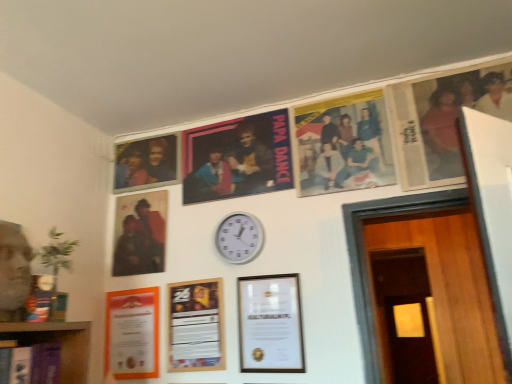
Locate an element on the screen. matte paper poster at upper center, marked as the 1th poster in a left-to-right arrangement is located at coordinates (237, 158).

Describe the element at coordinates (344, 144) in the screenshot. I see `printed paper poster at upper center, which ranks as the 2th poster in left-to-right order` at that location.

In order to click on matte orange certificate at lower left, which is the 2th picture frame from left to right in this screenshot , I will do `click(132, 334)`.

Describe the element at coordinates (442, 119) in the screenshot. I see `matte plastic photo frame at upper right, which is the first picture frame from right to left` at that location.

The width and height of the screenshot is (512, 384). I want to click on wooden door at lower right, so click(x=410, y=340).

The image size is (512, 384). I want to click on picture frame above the printed paper poster at upper center, marked as the 1th poster in a right-to-left arrangement (from a real-world perspective), so tap(146, 163).

Considering the positions of objects printed paper poster at upper center, which ranks as the 2th poster in left-to-right order, and matte plastic photo frame at upper left, which ranks as the third picture frame in left-to-right order, in the image provided, who is in front, printed paper poster at upper center, which ranks as the 2th poster in left-to-right order, or matte plastic photo frame at upper left, which ranks as the third picture frame in left-to-right order,?

printed paper poster at upper center, which ranks as the 2th poster in left-to-right order.

Which of these two, printed paper poster at upper center, marked as the 1th poster in a right-to-left arrangement, or matte plastic photo frame at upper left, the 4th picture frame positioned from the right, is thinner?

Thinner between the two is printed paper poster at upper center, marked as the 1th poster in a right-to-left arrangement.

Which is more to the left, printed paper poster at upper center, marked as the 1th poster in a right-to-left arrangement, or matte plastic photo frame at upper left, which ranks as the third picture frame in left-to-right order?

matte plastic photo frame at upper left, which ranks as the third picture frame in left-to-right order.

From a real-world perspective, is matte plastic photo frame at upper right, which is the first picture frame from right to left, positioned over wooden door at lower right based on gravity?

Yes, from a real-world perspective, matte plastic photo frame at upper right, which is the first picture frame from right to left, is on top of wooden door at lower right.

Which of these two, matte plastic photo frame at upper right, which is the first picture frame from right to left, or wooden door at lower right, is bigger?

With larger size is wooden door at lower right.

You are a GUI agent. You are given a task and a screenshot of the screen. Output one action in this format:
    pyautogui.click(x=<x>, y=<y>)
    Task: Click on the door on the right of matte plastic photo frame at upper right, arranged as the sixth picture frame when viewed from the left
    The image size is (512, 384).
    Given the screenshot: What is the action you would take?
    pyautogui.click(x=410, y=340)

Is matte plastic photo frame at upper right, which is the first picture frame from right to left, facing away from wooden door at lower right?

Yes, matte plastic photo frame at upper right, which is the first picture frame from right to left,'s orientation is away from wooden door at lower right.

Which object is further away from the camera, printed paper poster at upper center, which ranks as the 2th poster in left-to-right order, or wooden framed poster at center, which ranks as the third picture frame in right-to-left order?

wooden framed poster at center, which ranks as the third picture frame in right-to-left order.

Image resolution: width=512 pixels, height=384 pixels. Find the location of `the 2nd picture frame to the left when counting from the printed paper poster at upper center, marked as the 1th poster in a right-to-left arrangement`. the 2nd picture frame to the left when counting from the printed paper poster at upper center, marked as the 1th poster in a right-to-left arrangement is located at coordinates (196, 326).

Between point (319, 136) and point (190, 336), which one is positioned behind?

The point (319, 136) is more distant.

Based on the photo, is printed paper poster at upper center, marked as the 1th poster in a right-to-left arrangement, taller or shorter than wooden framed poster at center, marked as the 4th picture frame in a left-to-right arrangement?

In the image, printed paper poster at upper center, marked as the 1th poster in a right-to-left arrangement, appears to be taller than wooden framed poster at center, marked as the 4th picture frame in a left-to-right arrangement.

From the image's perspective, who appears lower, wooden framed poster at center, marked as the 4th picture frame in a left-to-right arrangement, or matte paper poster at upper center, arranged as the 2th poster when viewed from the right?

wooden framed poster at center, marked as the 4th picture frame in a left-to-right arrangement, appears lower in the image.

Which picture frame is the 2nd one when counting from the front of the matte paper poster at upper center, marked as the 1th poster in a left-to-right arrangement? Please provide its 2D coordinates.

[(196, 326)]

Considering the points (172, 359) and (203, 158), which point is behind, point (172, 359) or point (203, 158)?

The point (203, 158) is more distant.

Is matte paper poster at upper center, marked as the 1th poster in a left-to-right arrangement, located within wooden framed poster at center, which ranks as the third picture frame in right-to-left order?

No, matte paper poster at upper center, marked as the 1th poster in a left-to-right arrangement, is not inside wooden framed poster at center, which ranks as the third picture frame in right-to-left order.

In the scene shown: Can you confirm if white plastic wall clock at center is positioned to the right of printed paper poster at upper center, which ranks as the 2th poster in left-to-right order?

No, white plastic wall clock at center is not to the right of printed paper poster at upper center, which ranks as the 2th poster in left-to-right order.

How far apart are white plastic wall clock at center and printed paper poster at upper center, which ranks as the 2th poster in left-to-right order?

A distance of 40.55 centimeters exists between white plastic wall clock at center and printed paper poster at upper center, which ranks as the 2th poster in left-to-right order.

Could you tell me if white plastic wall clock at center is facing printed paper poster at upper center, marked as the 1th poster in a right-to-left arrangement?

No, white plastic wall clock at center is not turned towards printed paper poster at upper center, marked as the 1th poster in a right-to-left arrangement.

From the image's perspective, which one is positioned lower, white plastic wall clock at center or printed paper poster at upper center, which ranks as the 2th poster in left-to-right order?

white plastic wall clock at center.

From a real-world perspective, does white plastic wall clock at center stand above matte paper poster at upper center, arranged as the 2th poster when viewed from the right?

No, from a real-world perspective, white plastic wall clock at center is not above matte paper poster at upper center, arranged as the 2th poster when viewed from the right.

From the image's perspective, which is above, white plastic wall clock at center or matte paper poster at upper center, arranged as the 2th poster when viewed from the right?

matte paper poster at upper center, arranged as the 2th poster when viewed from the right, is shown above in the image.

Considering the relative positions of white plastic wall clock at center and matte paper poster at upper center, arranged as the 2th poster when viewed from the right, in the image provided, is white plastic wall clock at center to the left or to the right of matte paper poster at upper center, arranged as the 2th poster when viewed from the right,?

Clearly, white plastic wall clock at center is on the right of matte paper poster at upper center, arranged as the 2th poster when viewed from the right, in the image.

From the picture: Would you say white plastic wall clock at center contains matte paper poster at upper center, arranged as the 2th poster when viewed from the right?

Actually, matte paper poster at upper center, arranged as the 2th poster when viewed from the right, is outside white plastic wall clock at center.

Between matte plastic photo frame at upper right, arranged as the sixth picture frame when viewed from the left, and wooden picture frame at center, marked as the 2th picture frame in a right-to-left arrangement, which one has larger size?

matte plastic photo frame at upper right, arranged as the sixth picture frame when viewed from the left, is bigger.

Is matte plastic photo frame at upper right, arranged as the sixth picture frame when viewed from the left, shorter than wooden picture frame at center, positioned as the 5th picture frame in left-to-right order?

Incorrect, the height of matte plastic photo frame at upper right, arranged as the sixth picture frame when viewed from the left, does not fall short of that of wooden picture frame at center, positioned as the 5th picture frame in left-to-right order.

Where is `the 1st picture frame to the left of the matte plastic photo frame at upper right, which is the first picture frame from right to left, counting from the anchor's position`? The image size is (512, 384). the 1st picture frame to the left of the matte plastic photo frame at upper right, which is the first picture frame from right to left, counting from the anchor's position is located at coordinates pyautogui.click(x=270, y=324).

Are matte plastic photo frame at upper right, arranged as the sixth picture frame when viewed from the left, and wooden picture frame at center, marked as the 2th picture frame in a right-to-left arrangement, located far from each other?

No, matte plastic photo frame at upper right, arranged as the sixth picture frame when viewed from the left, is not far away from wooden picture frame at center, marked as the 2th picture frame in a right-to-left arrangement.

Where is `the 4th picture frame behind the printed paper poster at upper center, marked as the 1th poster in a right-to-left arrangement`? The width and height of the screenshot is (512, 384). the 4th picture frame behind the printed paper poster at upper center, marked as the 1th poster in a right-to-left arrangement is located at coordinates (146, 163).

The height and width of the screenshot is (384, 512). Find the location of `picture frame that is the 5th one above the wooden door at lower right (from a real-world perspective)`. picture frame that is the 5th one above the wooden door at lower right (from a real-world perspective) is located at coordinates (442, 119).

Looking at the image, which one is located further to matte paper poster at upper center, marked as the 1th poster in a left-to-right arrangement, wooden door at lower right or matte plastic photo frame at upper right, which is the first picture frame from right to left?

wooden door at lower right is further to matte paper poster at upper center, marked as the 1th poster in a left-to-right arrangement.

Looking at this image, considering their positions, is wooden framed poster at center, which ranks as the third picture frame in right-to-left order, positioned further to matte plastic photo frame at upper right, arranged as the sixth picture frame when viewed from the left, than wooden door at lower right?

Among the two, wooden door at lower right is located further to matte plastic photo frame at upper right, arranged as the sixth picture frame when viewed from the left.

Which object lies further to the anchor point printed paper poster at upper center, which ranks as the 2th poster in left-to-right order, wooden door at lower right or matte black photo frame at center-left, which is the sixth picture frame in right-to-left order?

wooden door at lower right is positioned further to the anchor printed paper poster at upper center, which ranks as the 2th poster in left-to-right order.

When comparing their distances from wooden framed poster at center, which ranks as the third picture frame in right-to-left order, does wooden door at lower right or printed paper poster at upper center, which ranks as the 2th poster in left-to-right order, seem closer?

printed paper poster at upper center, which ranks as the 2th poster in left-to-right order, lies closer to wooden framed poster at center, which ranks as the third picture frame in right-to-left order, than the other object.

Based on their spatial positions, is matte plastic photo frame at upper left, the 4th picture frame positioned from the right, or matte paper poster at upper center, arranged as the 2th poster when viewed from the right, closer to wooden picture frame at center, marked as the 2th picture frame in a right-to-left arrangement?

Among the two, matte paper poster at upper center, arranged as the 2th poster when viewed from the right, is located nearer to wooden picture frame at center, marked as the 2th picture frame in a right-to-left arrangement.

Looking at the image, which one is located further to white plastic wall clock at center, matte plastic photo frame at upper right, arranged as the sixth picture frame when viewed from the left, or wooden door at lower right?

The object further to white plastic wall clock at center is wooden door at lower right.

Considering their positions, is wooden door at lower right positioned closer to printed paper poster at upper center, which ranks as the 2th poster in left-to-right order, than matte plastic photo frame at upper right, arranged as the sixth picture frame when viewed from the left?

Among the two, matte plastic photo frame at upper right, arranged as the sixth picture frame when viewed from the left, is located nearer to printed paper poster at upper center, which ranks as the 2th poster in left-to-right order.

When comparing their distances from printed paper poster at upper center, which ranks as the 2th poster in left-to-right order, does matte paper poster at upper center, marked as the 1th poster in a left-to-right arrangement, or matte plastic photo frame at upper right, arranged as the sixth picture frame when viewed from the left, seem closer?

matte plastic photo frame at upper right, arranged as the sixth picture frame when viewed from the left, is positioned closer to the anchor printed paper poster at upper center, which ranks as the 2th poster in left-to-right order.

The height and width of the screenshot is (384, 512). I want to click on wall clock situated between matte orange certificate at lower left, which is the 2th picture frame from left to right, and printed paper poster at upper center, which ranks as the 2th poster in left-to-right order, from left to right, so click(x=239, y=238).

Identify the location of picture frame between white plastic wall clock at center and wooden framed poster at center, which ranks as the third picture frame in right-to-left order, in the up-down direction. This screenshot has width=512, height=384. (270, 324).

Find the location of `poster positioned between printed paper poster at upper center, marked as the 1th poster in a right-to-left arrangement, and wooden door at lower right from near to far`. poster positioned between printed paper poster at upper center, marked as the 1th poster in a right-to-left arrangement, and wooden door at lower right from near to far is located at coordinates (237, 158).

Find the location of a particular element. The image size is (512, 384). wall clock between matte plastic photo frame at upper left, which ranks as the third picture frame in left-to-right order, and printed paper poster at upper center, which ranks as the 2th poster in left-to-right order, in the horizontal direction is located at coordinates (239, 238).